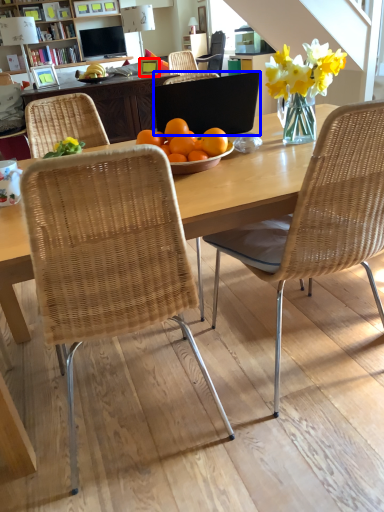
Question: Which of the following is the farthest to the observer, picture frame (highlighted by a red box) or laptop (highlighted by a blue box)?

Choices:
 (A) picture frame
 (B) laptop

Answer: (A)